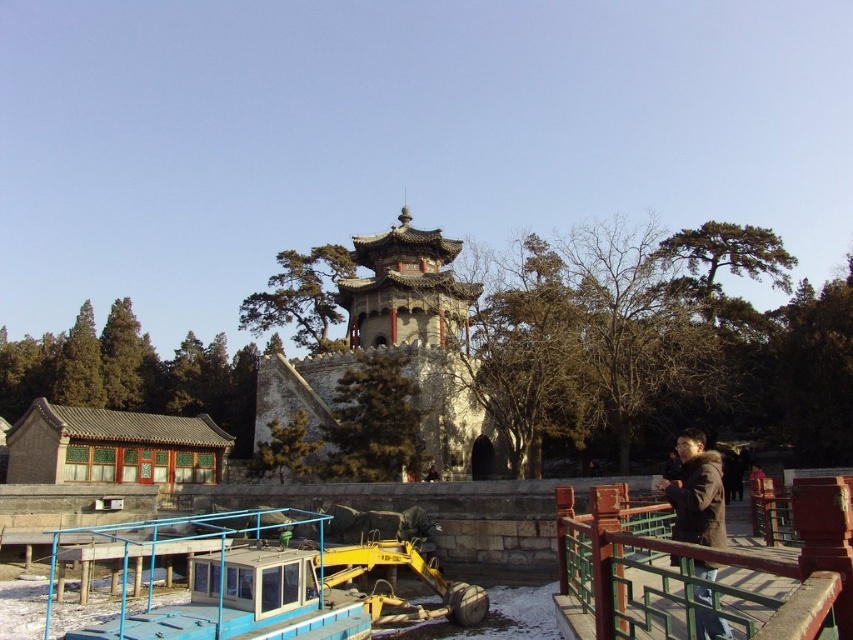
You are standing at the entrance of the pagoda and want to cross to the other side of the river. The green painted wood bridge at lower right is the only path available. If your average walking speed is 1.5 meters per second, how many seconds will it take you to reach the other side?

The green painted wood bridge at lower right is 15.94 meters from viewer. At a walking speed of 1.5 meters per second, it will take approximately 10.63 seconds to cross the bridge.

You are standing at the entrance of the pagoda and see the green painted wood bridge at lower right and the brown fuzzy jacket at lower right. Which object takes up more space in the scene?

The brown fuzzy jacket at lower right takes up more space in the scene than the green painted wood bridge at lower right because the green painted wood bridge at lower right occupies less space than brown fuzzy jacket at lower right.

You are standing in front of a traditional Chinese pagoda and a smaller building. A point at coordinates point (595, 636) is in the scene. If you want to take a photo that includes both the pagoda and the smaller building, will the point be in the background or foreground of the photo?

The point at point (595, 636) is 27.44 meters away from the camera, which places it in the background since it is farther away compared to the foreground elements like the smaller building and pagoda.